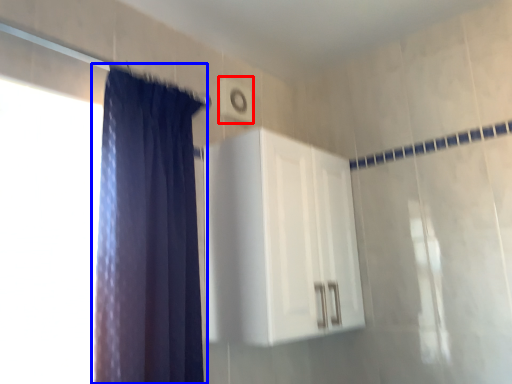
Question: Which object appears farthest to the camera in this image, light switch (highlighted by a red box) or curtain (highlighted by a blue box)?

Choices:
 (A) light switch
 (B) curtain

Answer: (A)